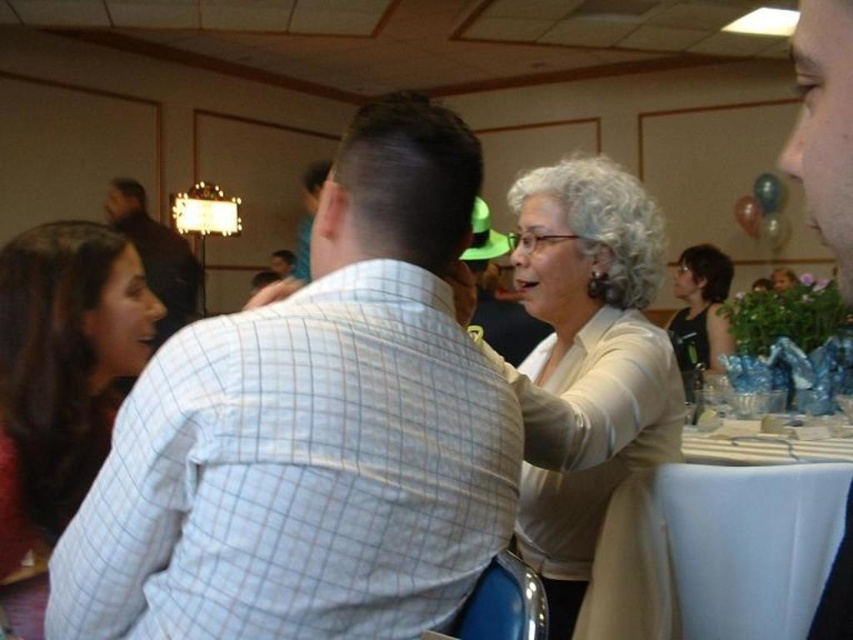
Question: Which object appears farthest from the camera in this image?

Choices:
 (A) white checkered shirt at center
 (B) matte white shirt at upper left
 (C) dark brown hair at left
 (D) white silk blouse at center

Answer: (B)

Question: Is white silk blouse at center behind white cloth at lower right?

Choices:
 (A) no
 (B) yes

Answer: (A)

Question: Is white silk blouse at center below white cloth at lower right?

Choices:
 (A) yes
 (B) no

Answer: (B)

Question: Which object appears closest to the camera in this image?

Choices:
 (A) matte white shirt at upper left
 (B) black fabric tank top at right
 (C) white silk blouse at center

Answer: (C)

Question: Which object is the farthest from the white cloth at lower right?

Choices:
 (A) matte white shirt at upper left
 (B) dark brown hair at left

Answer: (A)

Question: Does white checkered shirt at center have a smaller size compared to black fabric tank top at right?

Choices:
 (A) yes
 (B) no

Answer: (A)